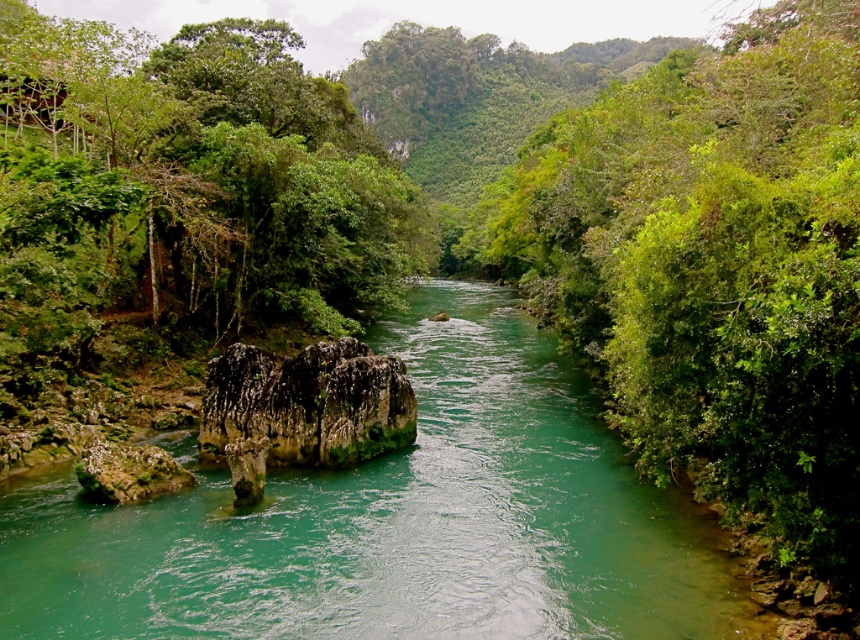
You are standing on the riverbank and want to cross the river to reach the green leafy tree at right. The green stone stream at center is flowing towards the tree. Which direction should you walk along the riverbank to find a safe crossing point where the stream is calmer?

You should walk upstream along the riverbank against the direction of the green stone stream at center flowing towards the green leafy tree at right. Calmer waters for crossing are typically found upstream where the current is slower.

You are a kayaker planning to navigate the river shown in the image. You need to know if the green stone stream at center is wider than the green leafy tree at right. Can you determine this based on the scene?

The green stone stream at center is wider than the green leafy tree at right, so yes, the stream is wider than the tree.

You are standing at the edge of the river and want to walk towards the green leafy tree at right. Will you pass by the green stone stream at center on your way?

Yes, you will pass by the green stone stream at center because it is closer to you than the green leafy tree at right, so you must go past it to reach the tree.